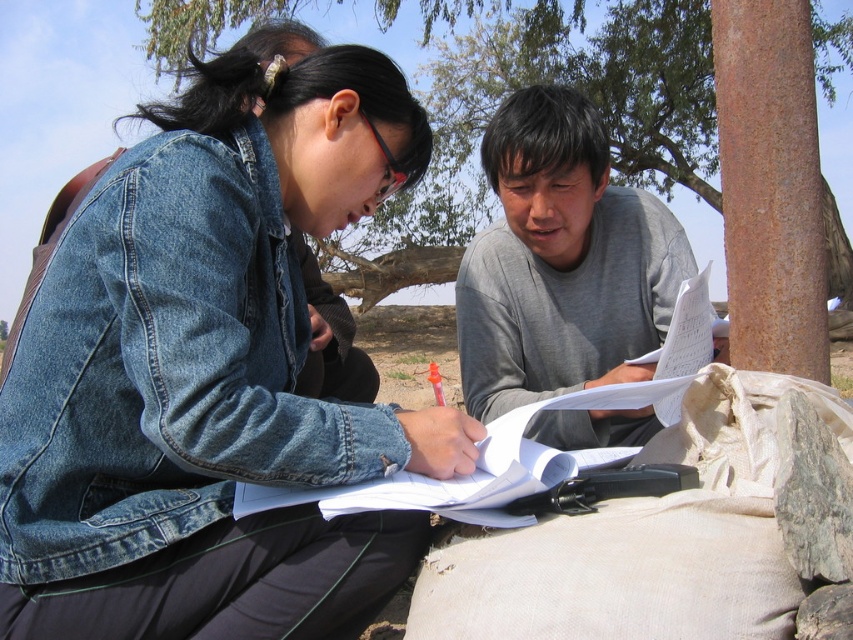
Is denim jacket at upper left thinner than brown rough tree at upper center?

Yes, denim jacket at upper left is thinner than brown rough tree at upper center.

Can you confirm if denim jacket at upper left is shorter than brown rough tree at upper center?

Yes, denim jacket at upper left is shorter than brown rough tree at upper center.

Is point (334, 179) positioned behind point (165, 58)?

No, it is not.

Identify the location of denim jacket at upper left. (212, 372).

Is the position of denim jacket at upper left more distant than that of gray cotton shirt at center?

That is False.

Which is in front, point (276, 86) or point (576, 381)?

Point (276, 86) is in front.

Who is more forward, (x=138, y=524) or (x=563, y=314)?

Point (x=138, y=524)

Identify the location of denim jacket at upper left. The height and width of the screenshot is (640, 853). (212, 372).

Who is lower down, gray cotton shirt at center or brown rough tree at upper center?

gray cotton shirt at center

Which is more to the right, gray cotton shirt at center or brown rough tree at upper center?

From the viewer's perspective, gray cotton shirt at center appears more on the right side.

Locate an element on the screen. This screenshot has height=640, width=853. gray cotton shirt at center is located at coordinates (561, 260).

I want to click on gray cotton shirt at center, so click(x=561, y=260).